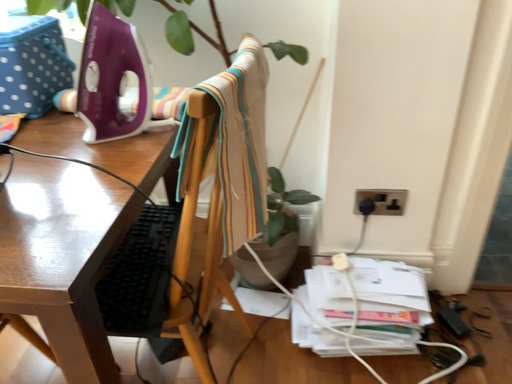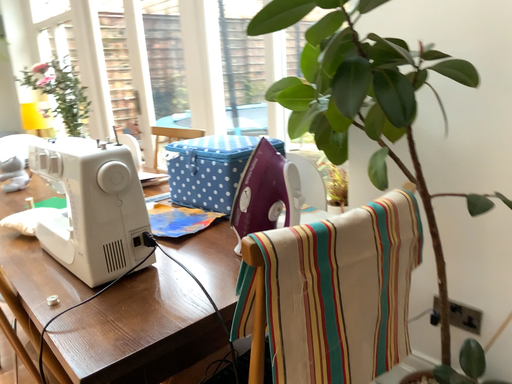
Question: How did the camera likely rotate when shooting the video?

Choices:
 (A) rotated left
 (B) rotated right

Answer: (A)